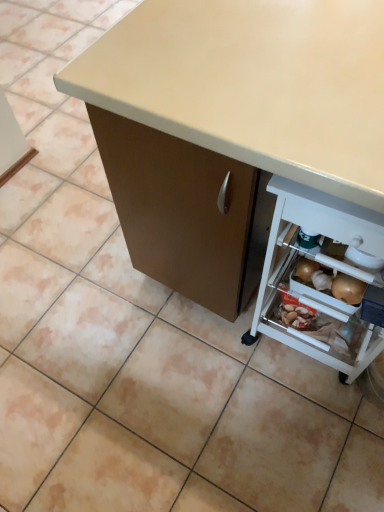
You are a GUI agent. You are given a task and a screenshot of the screen. Output one action in this format:
    pyautogui.click(x=<x>, y=<y>)
    Task: Click on the free spot in front of matte beige desk at center
    
    Given the screenshot: What is the action you would take?
    pyautogui.click(x=247, y=432)